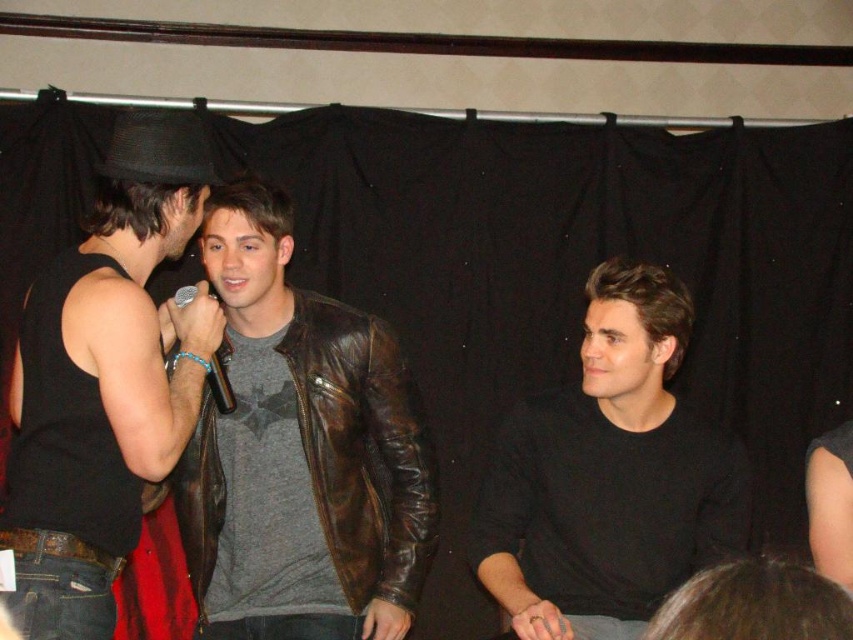
Question: Does black leather jacket at left have a greater width compared to metallic silver microphone at center?

Choices:
 (A) no
 (B) yes

Answer: (B)

Question: Does black matte shirt at center have a greater width compared to metallic silver microphone at center?

Choices:
 (A) yes
 (B) no

Answer: (A)

Question: Which point appears farthest from the camera in this image?

Choices:
 (A) (218, 465)
 (B) (183, 300)
 (C) (653, 348)
 (D) (90, 323)

Answer: (A)

Question: Considering the real-world distances, which object is farthest from the black matte shirt at center?

Choices:
 (A) brown leather jacket at center
 (B) metallic silver microphone at center

Answer: (B)

Question: Among these points, which one is farthest from the camera?

Choices:
 (A) (567, 400)
 (B) (102, 250)
 (C) (234, 403)

Answer: (A)

Question: Can you confirm if black leather jacket at left is positioned above black matte shirt at center?

Choices:
 (A) yes
 (B) no

Answer: (A)